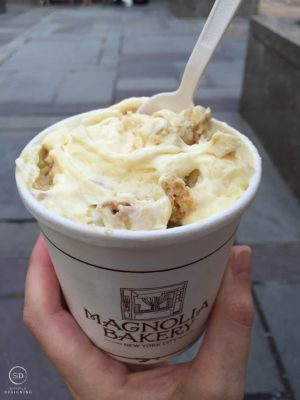
You are a GUI agent. You are given a task and a screenshot of the screen. Output one action in this format:
    pyautogui.click(x=<x>, y=<y>)
    Task: Click on the bowl of spoon
    Image resolution: width=300 pixels, height=400 pixels.
    Given the screenshot: What is the action you would take?
    pyautogui.click(x=172, y=102)